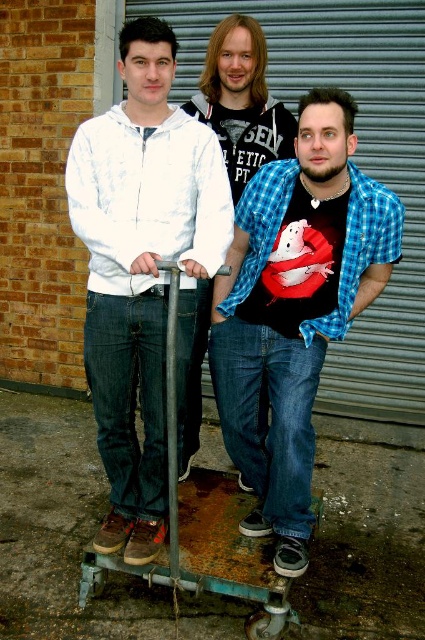
Question: Which point is closer to the camera?

Choices:
 (A) metallic gray garage door at upper center
 (B) matte black t-shirt at center

Answer: (B)

Question: Which object is the closest to the blue plaid shirt at center?

Choices:
 (A) rusty metal skateboard at lower center
 (B) metallic gray garage door at upper center
 (C) white cotton hoodie at center
 (D) matte black t-shirt at center

Answer: (C)

Question: Does blue plaid shirt at center appear over rusty metal skateboard at lower center?

Choices:
 (A) no
 (B) yes

Answer: (B)

Question: Does blue plaid shirt at center have a larger size compared to metallic gray garage door at upper center?

Choices:
 (A) no
 (B) yes

Answer: (A)

Question: Among these objects, which one is farthest from the camera?

Choices:
 (A) metallic gray garage door at upper center
 (B) rusty metal skateboard at lower center
 (C) matte black t-shirt at center
 (D) white cotton hoodie at center

Answer: (A)

Question: Is white cotton hoodie at center to the right of metallic gray garage door at upper center from the viewer's perspective?

Choices:
 (A) no
 (B) yes

Answer: (A)